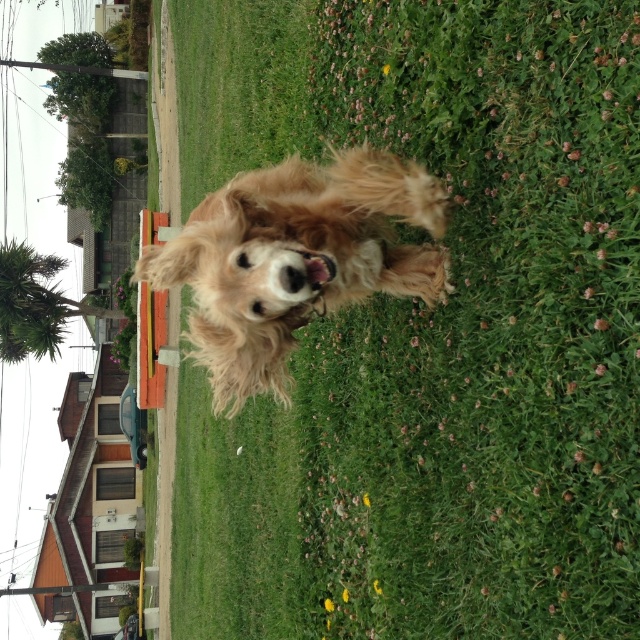
Measure the distance between green grass at center and camera.

green grass at center and camera are 5.62 meters apart from each other.

Who is more forward, (481, 170) or (173, 268)?

Point (173, 268) is in front.

Measure the distance between green grass at center and camera.

green grass at center and camera are 5.62 meters apart from each other.

This screenshot has height=640, width=640. In order to click on green grass at center in this screenshot , I will do `click(440, 323)`.

Does green grass at center lie behind green soft grass at center?

No, it is in front of green soft grass at center.

Who is positioned more to the right, green grass at center or green soft grass at center?

green grass at center is more to the right.

Locate an element on the screen. The width and height of the screenshot is (640, 640). green grass at center is located at coordinates (440, 323).

The image size is (640, 640). In order to click on green soft grass at center in this screenshot , I will do `click(234, 518)`.

Locate an element on the screen. Image resolution: width=640 pixels, height=640 pixels. green soft grass at center is located at coordinates (234, 518).

Locate an element on the screen. green soft grass at center is located at coordinates (234, 518).